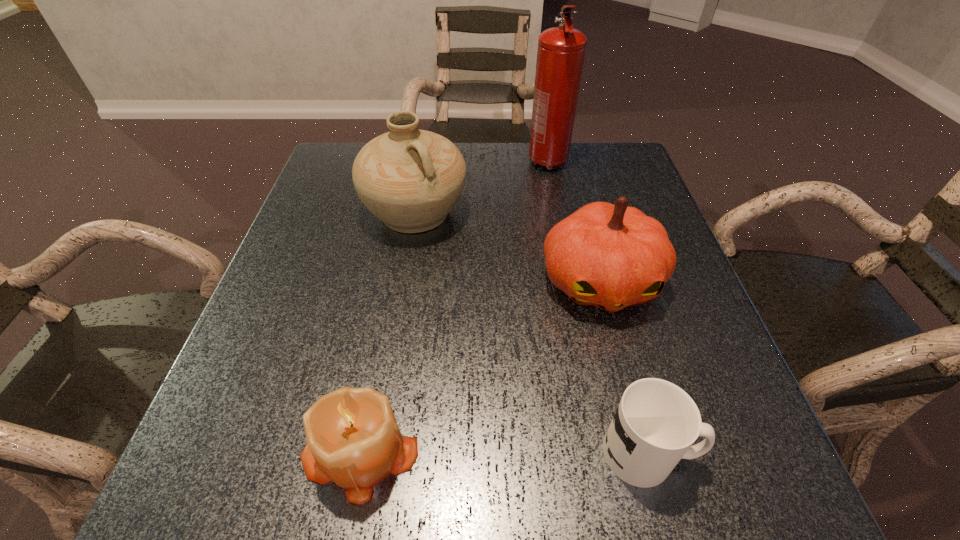
Locate an element on the screen. The height and width of the screenshot is (540, 960). the tallest object is located at coordinates (561, 50).

The height and width of the screenshot is (540, 960). I want to click on the farthest object, so click(x=561, y=50).

This screenshot has height=540, width=960. I want to click on pottery, so click(410, 179).

You are a GUI agent. You are given a task and a screenshot of the screen. Output one action in this format:
    pyautogui.click(x=<x>, y=<y>)
    Task: Click on the pumpkin
    Image resolution: width=960 pixels, height=540 pixels.
    Given the screenshot: What is the action you would take?
    pyautogui.click(x=609, y=256)

Find the location of a particular element. This screenshot has width=960, height=540. the second shortest object is located at coordinates (353, 439).

Find the location of a particular element. the shortest object is located at coordinates (656, 422).

You are a GUI agent. You are given a task and a screenshot of the screen. Output one action in this format:
    pyautogui.click(x=<x>, y=<y>)
    Task: Click on the free point located 0.320m on the handle side the tallest object
    
    Given the screenshot: What is the action you would take?
    coord(567,263)

What are the coordinates of `vacant space located 0.070m on the left of the pottery` in the screenshot? It's located at (334, 213).

This screenshot has height=540, width=960. I want to click on free space located on the front-facing side of the third shortest object, so click(x=625, y=374).

The width and height of the screenshot is (960, 540). I want to click on vacant area located on the back of the second shortest object, so click(x=378, y=355).